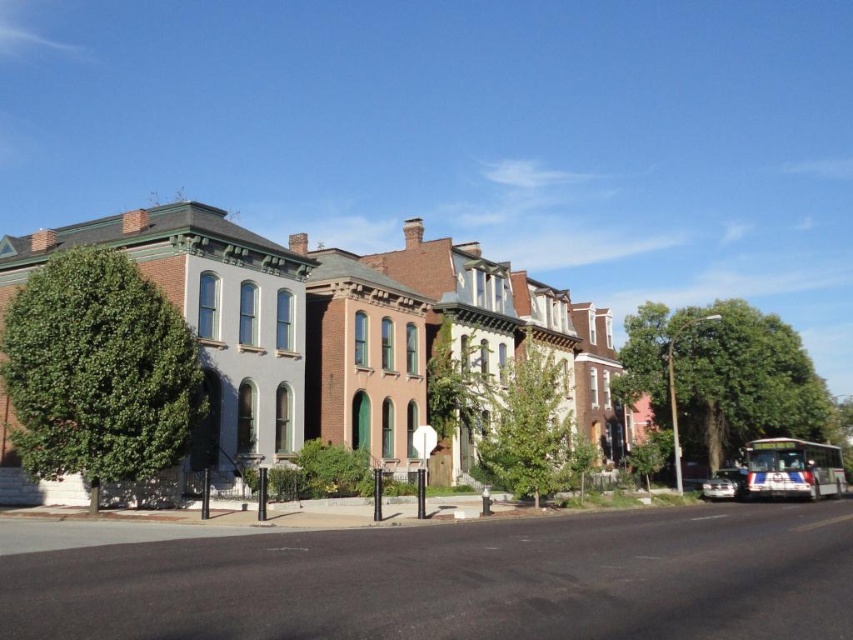
Question: Can you confirm if green leafy tree at right is positioned above white metallic bus at lower right?

Choices:
 (A) yes
 (B) no

Answer: (A)

Question: Does white metallic bus at lower right appear under shiny silver car at lower right?

Choices:
 (A) yes
 (B) no

Answer: (B)

Question: Considering the real-world distances, which object is closest to the white metallic bus at lower right?

Choices:
 (A) green leafy tree at center
 (B) green leafy tree at right
 (C) green leafy tree at left

Answer: (B)

Question: Which point is farther to the camera?

Choices:
 (A) green leafy tree at left
 (B) white metallic bus at lower right

Answer: (B)

Question: Which is nearer to the shiny silver car at lower right?

Choices:
 (A) green leafy tree at right
 (B) green leafy tree at center
 (C) white metallic bus at lower right
 (D) green leafy tree at left

Answer: (C)

Question: Is green leafy tree at left below green leafy tree at center?

Choices:
 (A) no
 (B) yes

Answer: (A)